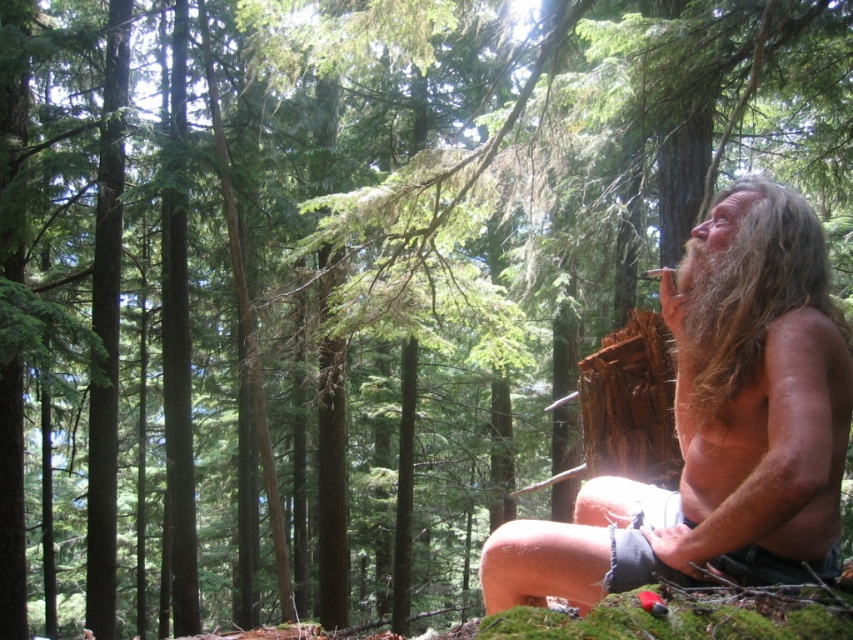
Between shaggy hair at right and long brown hair at upper right, which one is positioned higher?

Positioned higher is long brown hair at upper right.

Where is `shaggy hair at right`? This screenshot has width=853, height=640. shaggy hair at right is located at coordinates (718, 436).

Based on the photo, which is more to the right, shaggy hair at right or brown wavy hair at right?

brown wavy hair at right

Between shaggy hair at right and brown wavy hair at right, which one is positioned lower?

shaggy hair at right is below.

Is point (575, 596) positioned behind point (735, 394)?

Yes, point (575, 596) is farther from viewer.

The image size is (853, 640). In order to click on shaggy hair at right in this screenshot , I will do coord(718,436).

Does brown wavy hair at right appear under long brown hair at upper right?

Yes.

Who is lower down, brown wavy hair at right or long brown hair at upper right?

brown wavy hair at right

Where is `brown wavy hair at right`? brown wavy hair at right is located at coordinates (749, 285).

Identify the location of brown wavy hair at right. (749, 285).